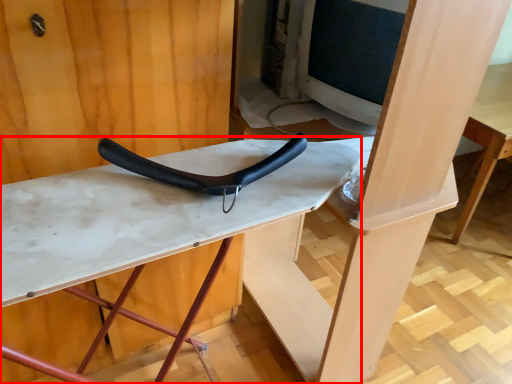
Question: Where is table (annotated by the red box) located in relation to handle in the image?

Choices:
 (A) left
 (B) right

Answer: (A)